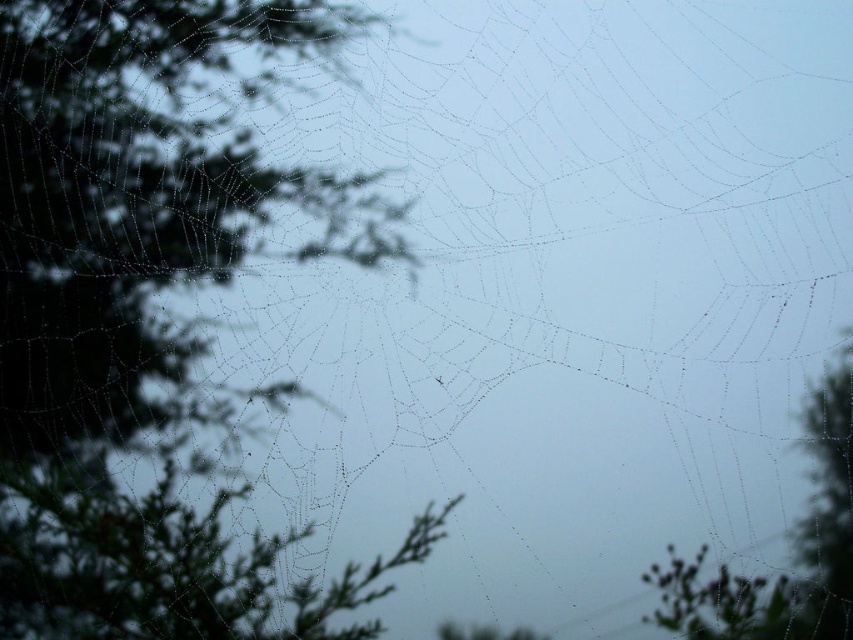
You are observing the spiderweb against the sky and notice two green leafy trees in the foreground. Which tree, the green leafy tree at left or the green leafy tree at right, is positioned higher in the image?

The green leafy tree at left is located above the green leafy tree at right, so it is positioned higher in the image.